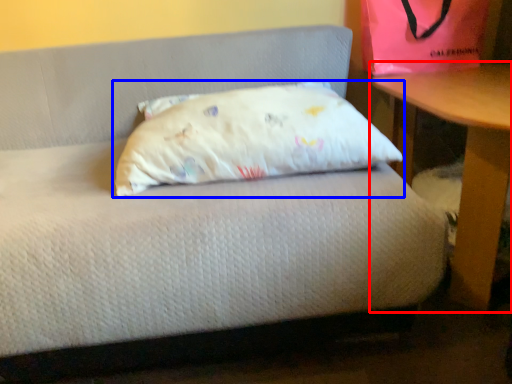
Question: Among these objects, which one is nearest to the camera, table (highlighted by a red box) or pillow (highlighted by a blue box)?

Choices:
 (A) table
 (B) pillow

Answer: (A)